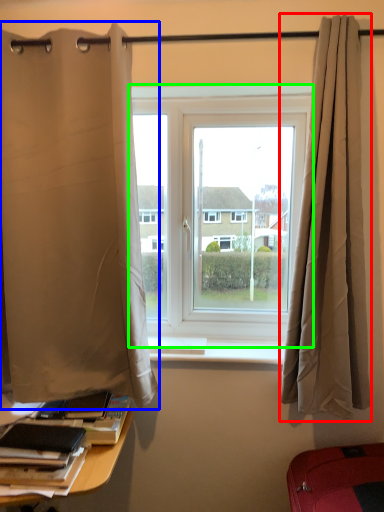
Question: Estimate the real-world distances between objects in this image. Which object is farther from curtain (highlighted by a red box), curtain (highlighted by a blue box) or window (highlighted by a green box)?

Choices:
 (A) curtain
 (B) window

Answer: (A)